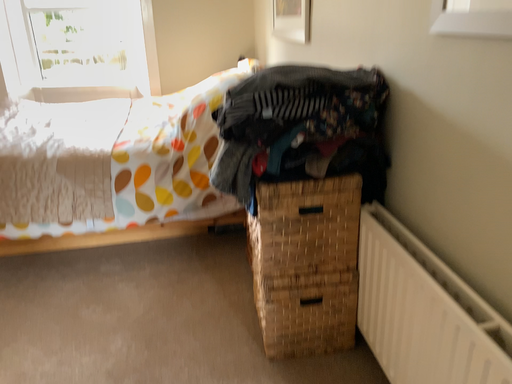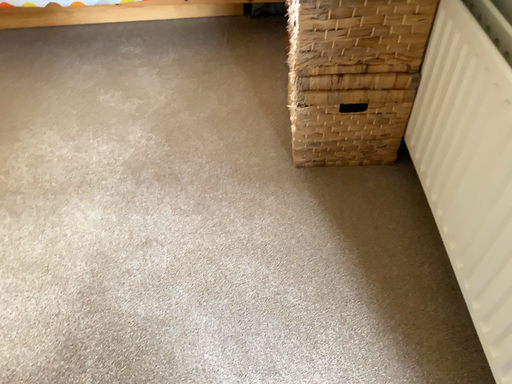
Question: How did the camera likely rotate when shooting the video?

Choices:
 (A) rotated right
 (B) rotated left

Answer: (B)